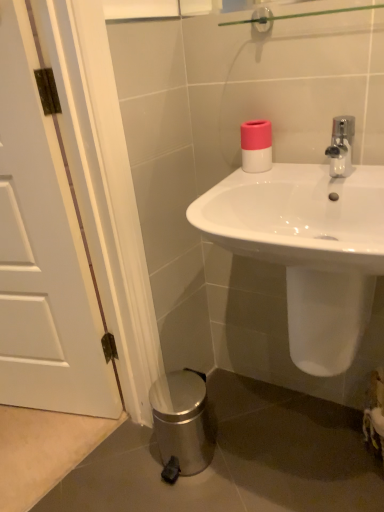
Question: From the image's perspective, relative to white matte door at left, is pink matte toilet paper at upper right above or below?

Choices:
 (A) below
 (B) above

Answer: (B)

Question: In terms of height, does pink matte toilet paper at upper right look taller or shorter compared to white matte door at left?

Choices:
 (A) tall
 (B) short

Answer: (B)

Question: Which object is positioned closest to the pink matte toilet paper at upper right?

Choices:
 (A) white matte door at left
 (B) white glossy sink at center

Answer: (B)

Question: Which object is the closest to the white glossy sink at center?

Choices:
 (A) white matte door at left
 (B) pink matte toilet paper at upper right

Answer: (B)